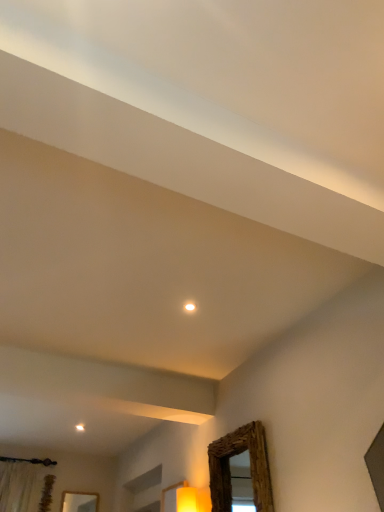
What do you see at coordinates (250, 467) in the screenshot?
I see `wooden frame at upper right` at bounding box center [250, 467].

Image resolution: width=384 pixels, height=512 pixels. Find the location of `wooden frame at upper right`. wooden frame at upper right is located at coordinates (250, 467).

In order to face wooden frame at upper right, should I rotate leftwards or rightwards?

Rotate right and turn 5.736 degrees.

Measure the distance between wooden frame at upper right and camera.

8.02 feet.

Identify the location of wooden frame at upper right. Image resolution: width=384 pixels, height=512 pixels. (250, 467).